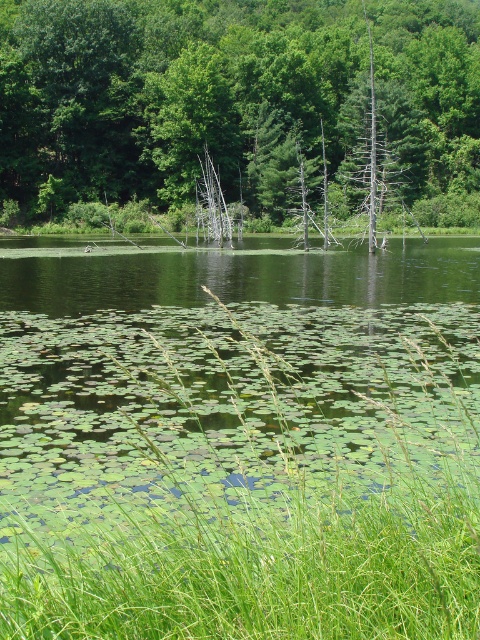
Does green grass at lower left have a lesser height compared to green leafy tree at center?

Yes, green grass at lower left is shorter than green leafy tree at center.

Image resolution: width=480 pixels, height=640 pixels. I want to click on green grass at lower left, so (240, 474).